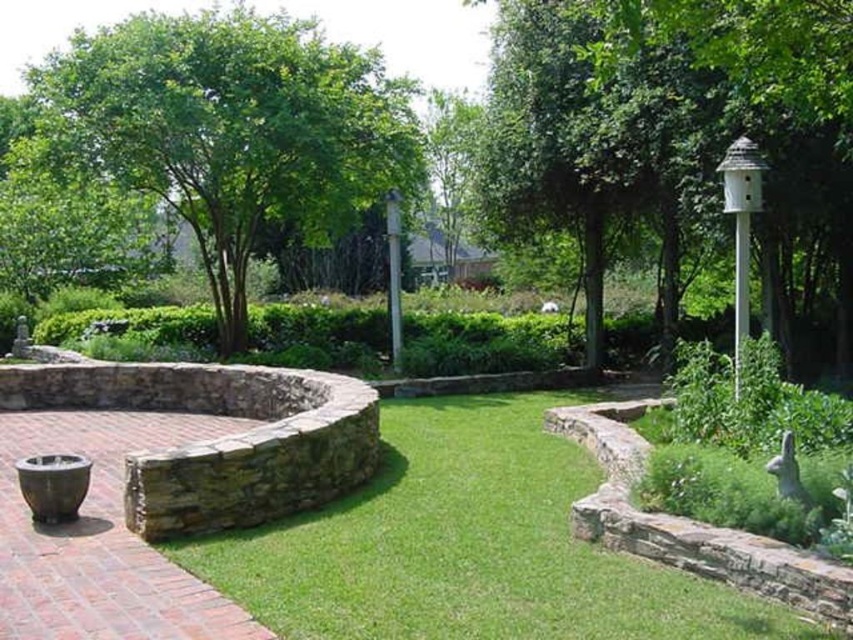
Based on the photo, you are standing in the garden and want to place a new decorative item between the white wood birdhouse at upper right and the green leafy tree at upper left. Based on their positions, where should you place the item to ensure it is between them?

The white wood birdhouse at upper right is positioned on the right side of the green leafy tree at upper left, so placing the item between them would require positioning it to the right of the green leafy tree at upper left and to the left of the white wood birdhouse at upper right.

You are standing at the center of the garden and want to place a new bench between the two points labeled point (767, 173) and point (670, 596). Considering their positions, which point should the bench be closer to so it doesn not block the pathway leading to the seating area?

The bench should be placed closer to point (670, 596) because point (767, 173) is behind point (670, 596), so positioning the bench near the front point would keep the pathway to the seating area clear.

You are standing in the garden and want to place a new decorative item. You have two points marked on the map as point coordinates. Which point is closer to you, point (376, 609) or point (347, 106)?

Point (376, 609) is closer to the viewer than point (347, 106), so you should place the decorative item there if you want it nearer to your current position.